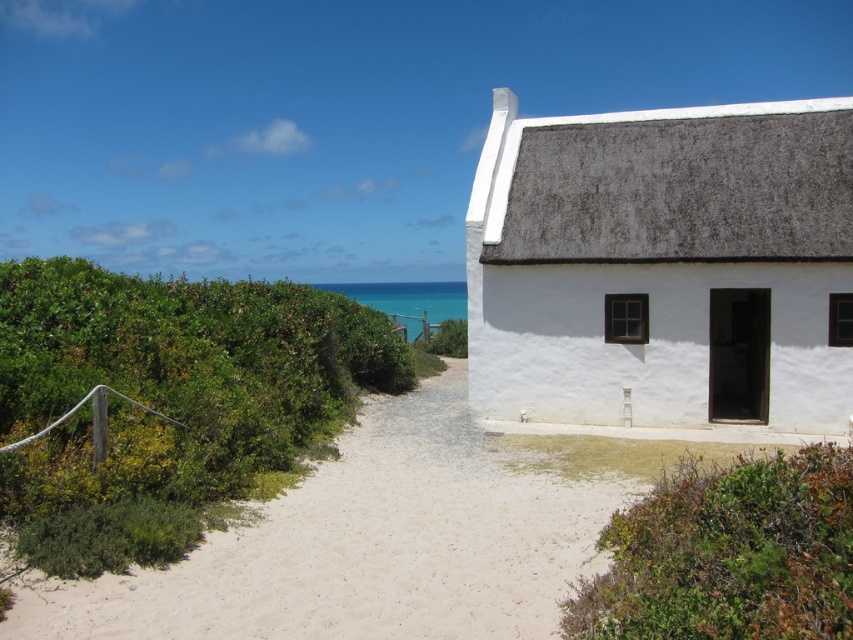
You are a visitor approaching the coastal house and want to walk along the white sandy path at center. As you walk, you notice the green leafy bush at lower right. Where is the bush located relative to the path?

The green leafy bush at lower right is behind the white sandy path at center, so it is positioned behind the path as you walk towards the house.

You are standing at the entrance of the white house and want to walk to the ocean. According to the coordinates provided, where should you head? Please provide the coordinates in the format of a point like point [364,547].

The white sandy path at center is represented by point [364,547], so you should head towards point [364,547].